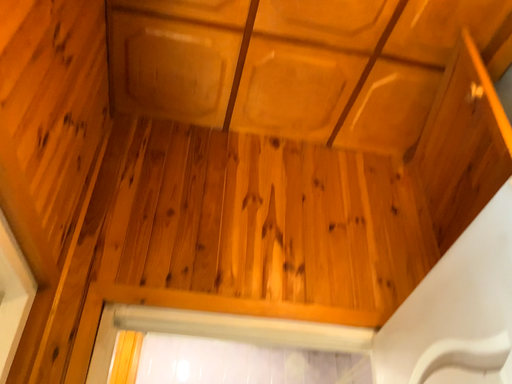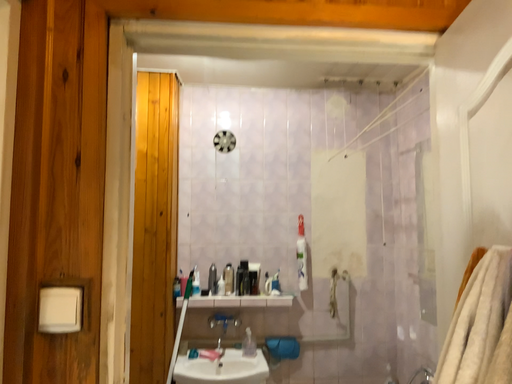
Question: Which way did the camera rotate in the video?

Choices:
 (A) rotated downward
 (B) rotated upward

Answer: (A)